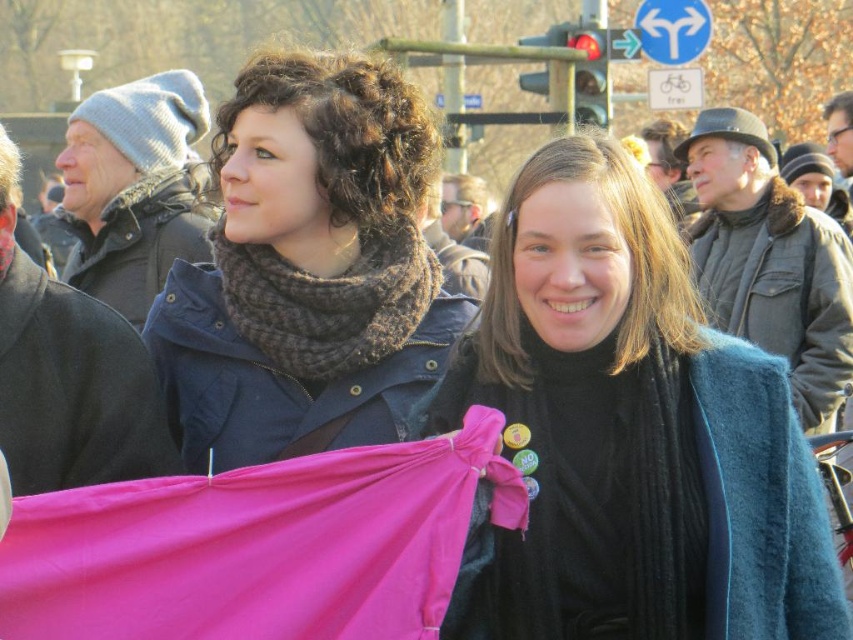
Question: Does velvet teal coat at center have a greater width compared to brown knitted scarf at center?

Choices:
 (A) yes
 (B) no

Answer: (B)

Question: Is knitted wool scarf at center wider than brown knitted scarf at center?

Choices:
 (A) no
 (B) yes

Answer: (B)

Question: Can you confirm if knitted wool scarf at center is positioned above brown knitted scarf at center?

Choices:
 (A) no
 (B) yes

Answer: (B)

Question: Which point is farther to the camera?

Choices:
 (A) velvet teal coat at center
 (B) brown knitted scarf at center

Answer: (B)

Question: Which of these objects is positioned farthest from the brown knitted scarf at center?

Choices:
 (A) knitted wool scarf at center
 (B) velvet teal coat at center

Answer: (B)

Question: Which point is farther from the camera taking this photo?

Choices:
 (A) (602, 400)
 (B) (287, 337)
 (C) (403, 228)

Answer: (C)